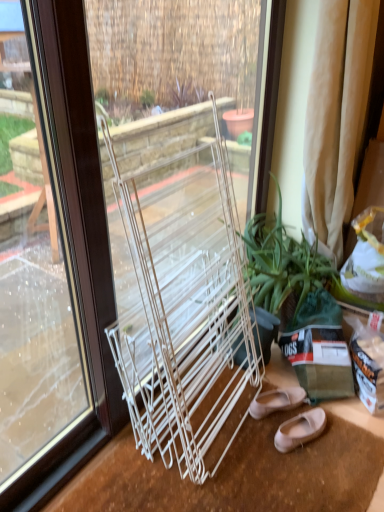
Question: Is point (299, 262) positioned closer to the camera than point (306, 126)?

Choices:
 (A) farther
 (B) closer

Answer: (A)

Question: Is green leafy plant at center to the left or to the right of beige fabric curtain at right in the image?

Choices:
 (A) right
 (B) left

Answer: (B)

Question: Based on their relative distances, which object is farther from the clear glass window at center?

Choices:
 (A) beige fabric curtain at right
 (B) matte beige flats at lower right, marked as the second footwear in a front-to-back arrangement
 (C) green leafy plant at center
 (D) matte pink leather ballet flats at lower right, the 1th footwear in the front-to-back sequence

Answer: (A)

Question: Based on their relative distances, which object is farther from the beige fabric curtain at right?

Choices:
 (A) green leafy plant at center
 (B) matte beige flats at lower right, marked as the second footwear in a front-to-back arrangement
 (C) clear glass window at center
 (D) matte pink leather ballet flats at lower right, arranged as the second footwear when viewed from the back

Answer: (D)